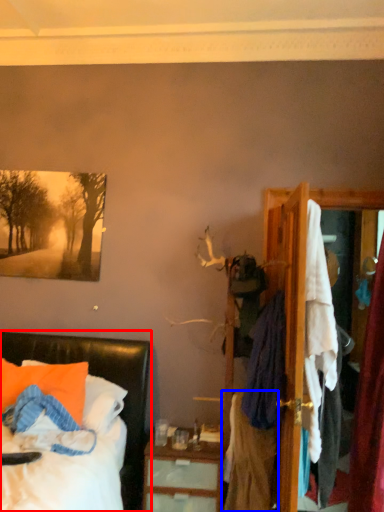
Question: Among these objects, which one is farthest to the camera, bed (highlighted by a red box) or clothing (highlighted by a blue box)?

Choices:
 (A) bed
 (B) clothing

Answer: (B)